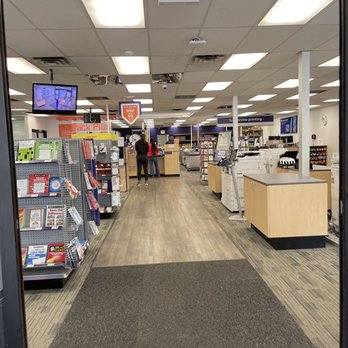
Locate an element on the screen. This screenshot has width=348, height=348. tv screen is located at coordinates (50, 94).